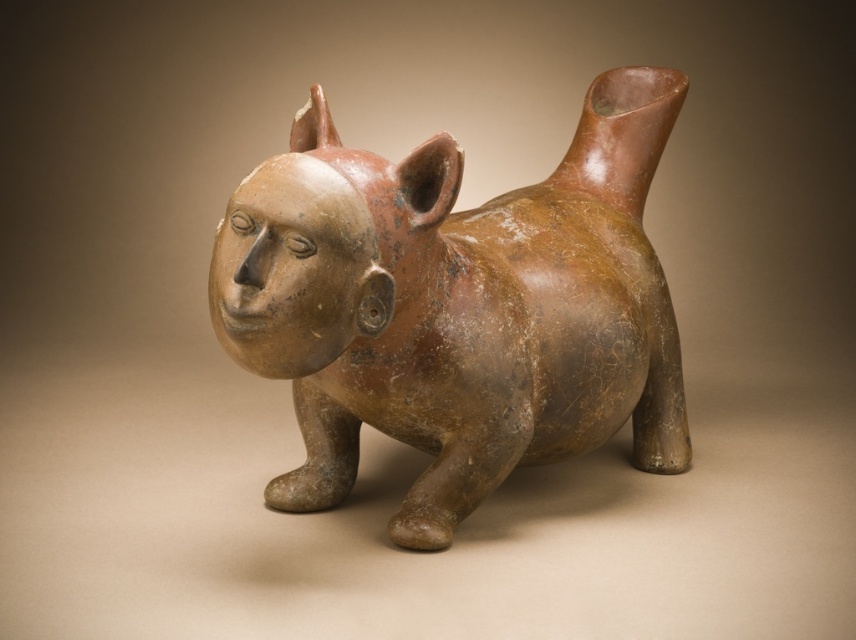
Question: Is brown matte animal at center thinner than matte clay head at center?

Choices:
 (A) no
 (B) yes

Answer: (A)

Question: Among these objects, which one is farthest from the camera?

Choices:
 (A) brown matte animal at center
 (B) matte clay head at center

Answer: (A)

Question: Which point is closer to the camera taking this photo?

Choices:
 (A) (473, 314)
 (B) (351, 269)

Answer: (B)

Question: Can you confirm if brown matte animal at center is smaller than matte clay head at center?

Choices:
 (A) yes
 (B) no

Answer: (B)

Question: Does brown matte animal at center have a lesser width compared to matte clay head at center?

Choices:
 (A) no
 (B) yes

Answer: (A)

Question: Among these points, which one is farthest from the camera?

Choices:
 (A) (598, 422)
 (B) (262, 166)

Answer: (A)